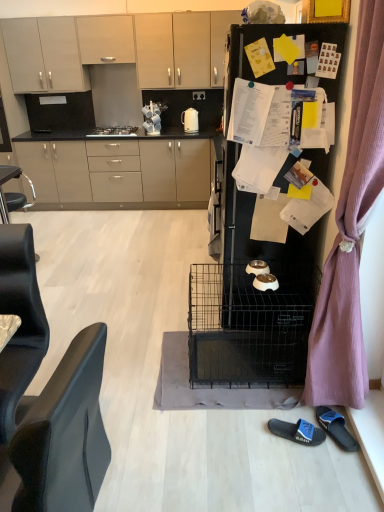
Question: In which direction should I rotate to look at white glossy electric kettle at upper center?

Choices:
 (A) right
 (B) left

Answer: (B)

Question: Is satin silver gas stove at upper center at the right side of purple fabric curtain at right?

Choices:
 (A) no
 (B) yes

Answer: (A)

Question: Considering the relative sizes of satin silver gas stove at upper center and purple fabric curtain at right in the image provided, is satin silver gas stove at upper center shorter than purple fabric curtain at right?

Choices:
 (A) no
 (B) yes

Answer: (B)

Question: Is satin silver gas stove at upper center turned away from purple fabric curtain at right?

Choices:
 (A) no
 (B) yes

Answer: (A)

Question: From the image's perspective, would you say satin silver gas stove at upper center is shown under purple fabric curtain at right?

Choices:
 (A) no
 (B) yes

Answer: (A)

Question: Considering the relative positions of satin silver gas stove at upper center and purple fabric curtain at right in the image provided, is satin silver gas stove at upper center to the left of purple fabric curtain at right from the viewer's perspective?

Choices:
 (A) no
 (B) yes

Answer: (B)

Question: Would you say satin silver gas stove at upper center is a long distance from purple fabric curtain at right?

Choices:
 (A) yes
 (B) no

Answer: (A)

Question: Considering the relative positions of purple fabric curtain at right and black matte refrigerator at upper right in the image provided, is purple fabric curtain at right to the right of black matte refrigerator at upper right from the viewer's perspective?

Choices:
 (A) yes
 (B) no

Answer: (A)

Question: Would you say purple fabric curtain at right is outside black matte refrigerator at upper right?

Choices:
 (A) no
 (B) yes

Answer: (B)

Question: From the image's perspective, does purple fabric curtain at right appear lower than black matte refrigerator at upper right?

Choices:
 (A) no
 (B) yes

Answer: (B)

Question: Is purple fabric curtain at right turned away from black matte refrigerator at upper right?

Choices:
 (A) no
 (B) yes

Answer: (A)

Question: Could you tell me if purple fabric curtain at right is facing black matte refrigerator at upper right?

Choices:
 (A) no
 (B) yes

Answer: (A)

Question: Is purple fabric curtain at right next to black matte refrigerator at upper right and touching it?

Choices:
 (A) yes
 (B) no

Answer: (B)

Question: Can you confirm if matte beige cabinets at center, the first cabinetry positioned from the bottom, is smaller than purple fabric curtain at right?

Choices:
 (A) yes
 (B) no

Answer: (B)